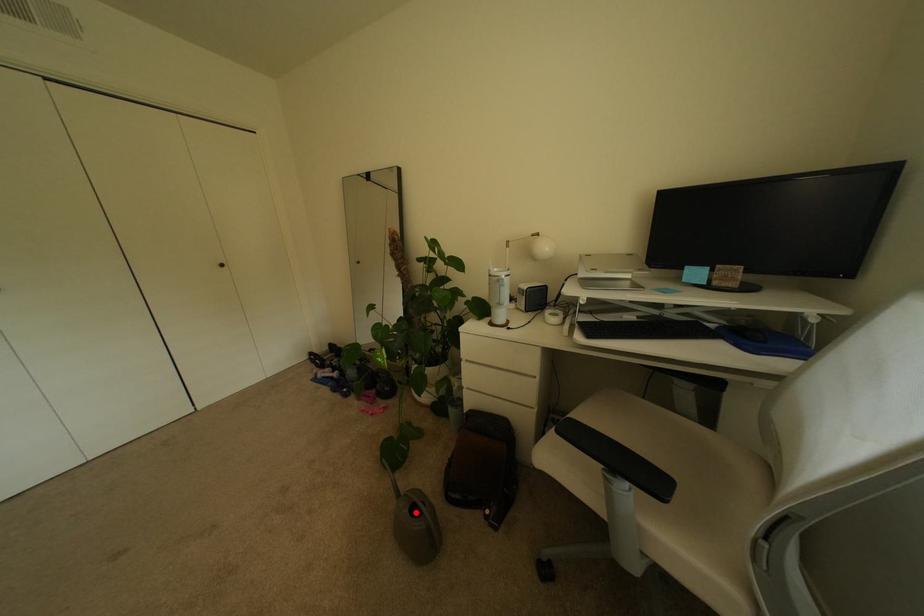
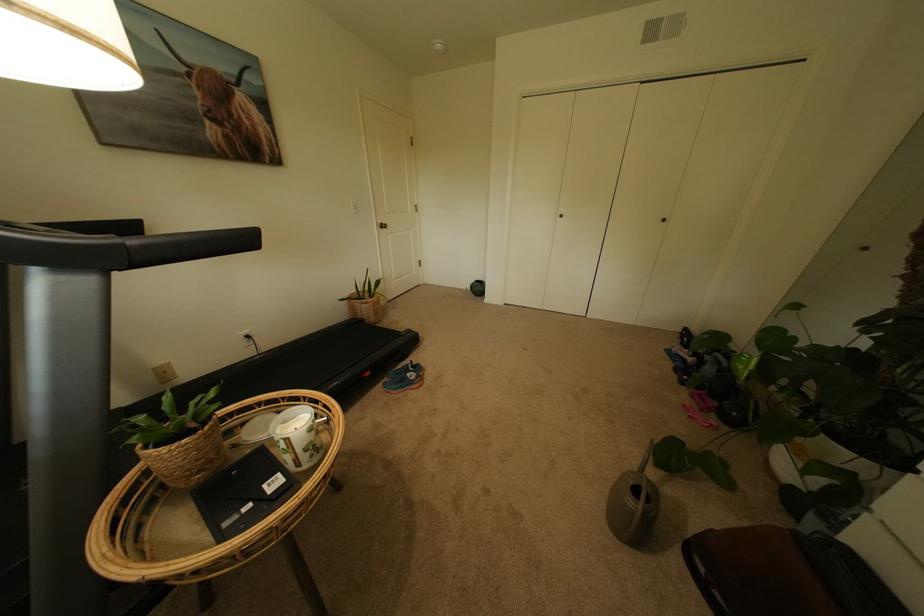
Where in the second image is the point corresponding to the highlighted location from the first image?

(639, 484)